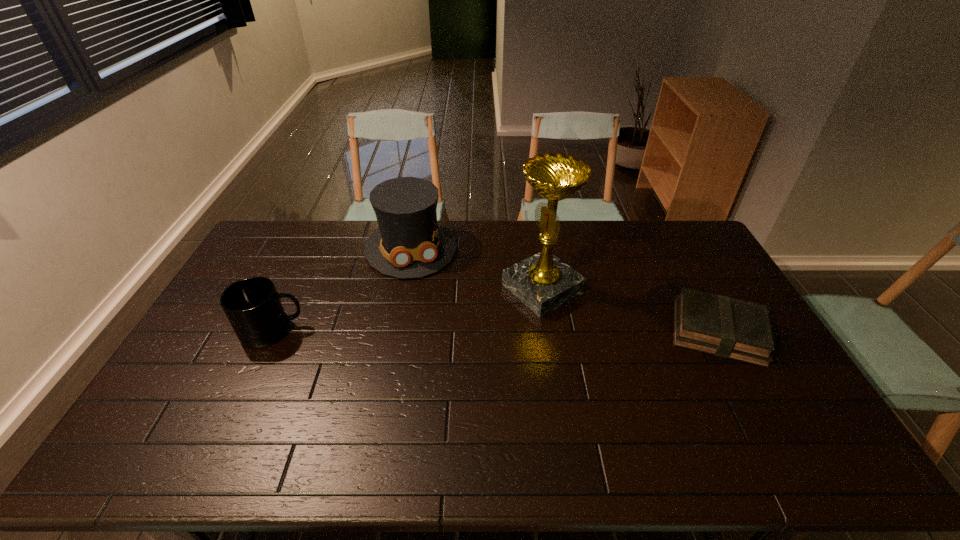
Where is `free space on the desktop that is between the mug and the rightmost object and is positioned with goggles on the front of the third shortest object`? The width and height of the screenshot is (960, 540). free space on the desktop that is between the mug and the rightmost object and is positioned with goggles on the front of the third shortest object is located at coordinates (438, 331).

The image size is (960, 540). Find the location of `free space on the desktop that is between the leftmost object and the shortest object and is positioned on the front-facing side of the third object from left to right`. free space on the desktop that is between the leftmost object and the shortest object and is positioned on the front-facing side of the third object from left to right is located at coordinates (461, 331).